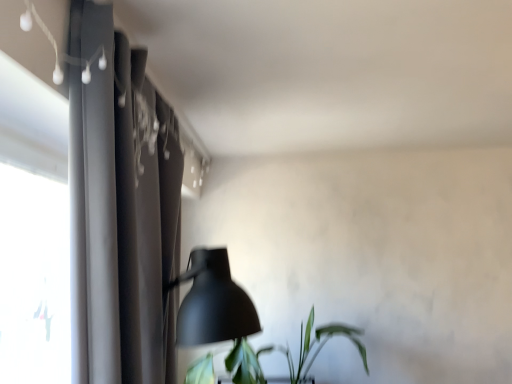
Question: Considering the relative sizes of dark gray fabric curtain at left and green leafy plant at lower right in the image provided, is dark gray fabric curtain at left smaller than green leafy plant at lower right?

Choices:
 (A) yes
 (B) no

Answer: (A)

Question: Can you confirm if dark gray fabric curtain at left is bigger than green leafy plant at lower right?

Choices:
 (A) yes
 (B) no

Answer: (B)

Question: From a real-world perspective, is dark gray fabric curtain at left over green leafy plant at lower right?

Choices:
 (A) no
 (B) yes

Answer: (B)

Question: Does dark gray fabric curtain at left lie behind green leafy plant at lower right?

Choices:
 (A) yes
 (B) no

Answer: (B)

Question: From the image's perspective, is dark gray fabric curtain at left on top of green leafy plant at lower right?

Choices:
 (A) no
 (B) yes

Answer: (B)

Question: Could green leafy plant at lower right be considered to be inside dark gray fabric curtain at left?

Choices:
 (A) no
 (B) yes

Answer: (A)

Question: Can you confirm if green leafy plant at lower right is wider than dark gray fabric curtain at left?

Choices:
 (A) yes
 (B) no

Answer: (A)

Question: From a real-world perspective, is green leafy plant at lower right over dark gray fabric curtain at left?

Choices:
 (A) no
 (B) yes

Answer: (A)

Question: Does green leafy plant at lower right have a greater height compared to dark gray fabric curtain at left?

Choices:
 (A) yes
 (B) no

Answer: (B)

Question: Is green leafy plant at lower right outside of dark gray fabric curtain at left?

Choices:
 (A) yes
 (B) no

Answer: (A)

Question: Is the depth of green leafy plant at lower right greater than that of dark gray fabric curtain at left?

Choices:
 (A) yes
 (B) no

Answer: (A)

Question: Can you confirm if green leafy plant at lower right is positioned to the right of dark gray fabric curtain at left?

Choices:
 (A) no
 (B) yes

Answer: (B)

Question: Considering the relative positions of green leafy plant at lower right and dark gray fabric curtain at left in the image provided, is green leafy plant at lower right to the left or to the right of dark gray fabric curtain at left?

Choices:
 (A) left
 (B) right

Answer: (B)